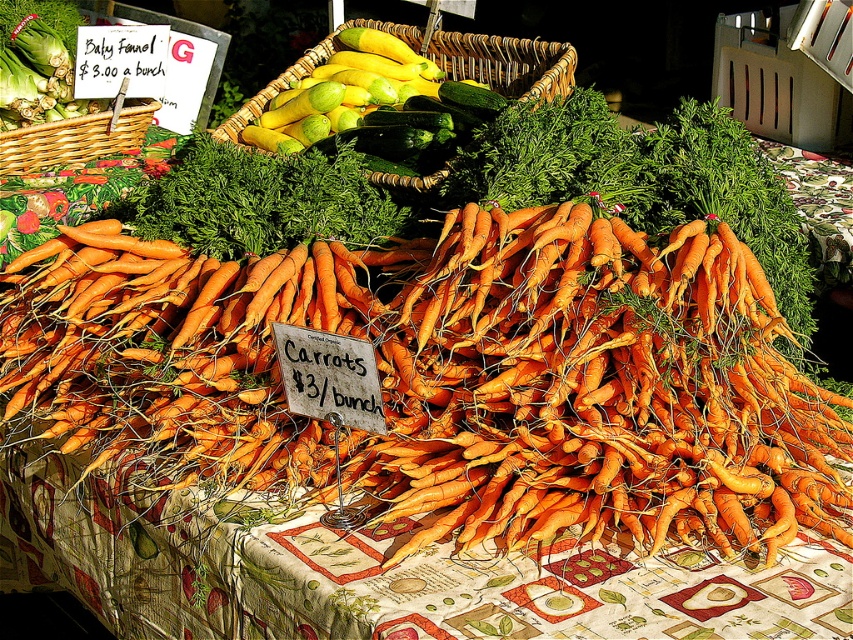
Question: Does woven wicker basket at upper center appear under woven brown basket at left?

Choices:
 (A) yes
 (B) no

Answer: (B)

Question: Can you confirm if green leafy at center is smaller than green leafy fennel at upper left?

Choices:
 (A) no
 (B) yes

Answer: (A)

Question: Which object is positioned farthest from the green leafy at center?

Choices:
 (A) woven brown basket at left
 (B) woven wicker basket at upper center
 (C) green leafy fennel at upper left
 (D) orange matte carrots at center

Answer: (C)

Question: Among these objects, which one is farthest from the camera?

Choices:
 (A) woven brown basket at left
 (B) orange matte carrots at center
 (C) green leafy fennel at upper left

Answer: (C)

Question: Which object is the closest to the orange matte carrots at center?

Choices:
 (A) woven wicker basket at upper center
 (B) woven brown basket at left
 (C) green leafy at center

Answer: (C)

Question: Does green leafy fennel at upper left come in front of woven brown basket at left?

Choices:
 (A) no
 (B) yes

Answer: (A)